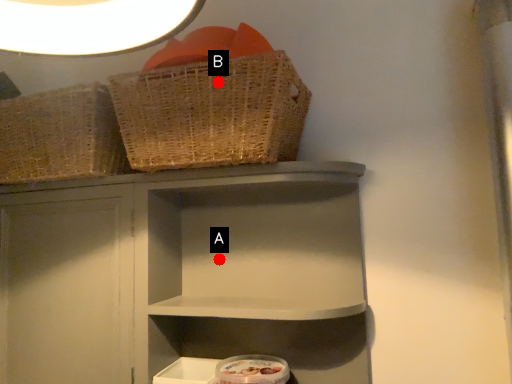
Question: Two points are circled on the image, labeled by A and B beside each circle. Which point is closer to the camera taking this photo?

Choices:
 (A) A is closer
 (B) B is closer

Answer: (B)